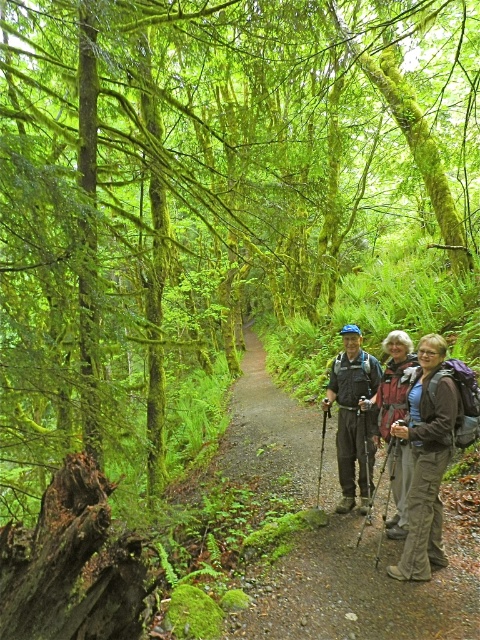
You are a hiker with a 4.5 feet wide backpack. You are standing on the gravel path at center and want to pass the matte gray jacket at center. Can your backpack fit through the space between them?

The distance between the gravel path at center and the matte gray jacket at center is 5.05 feet. Since your backpack is 4.5 feet wide, it can fit through the space as there is enough clearance.

You are a hiker standing on the path in the forest scene. You notice two points marked on the image. Which point is closer to you, point (276, 634) or point (431, 480)?

Point (276, 634) is closer to the viewer than point (431, 480).